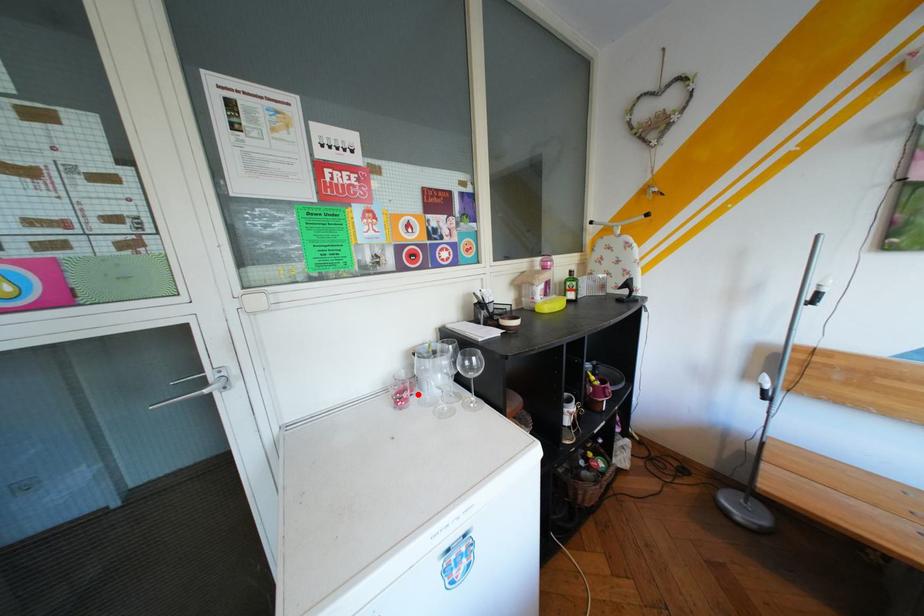
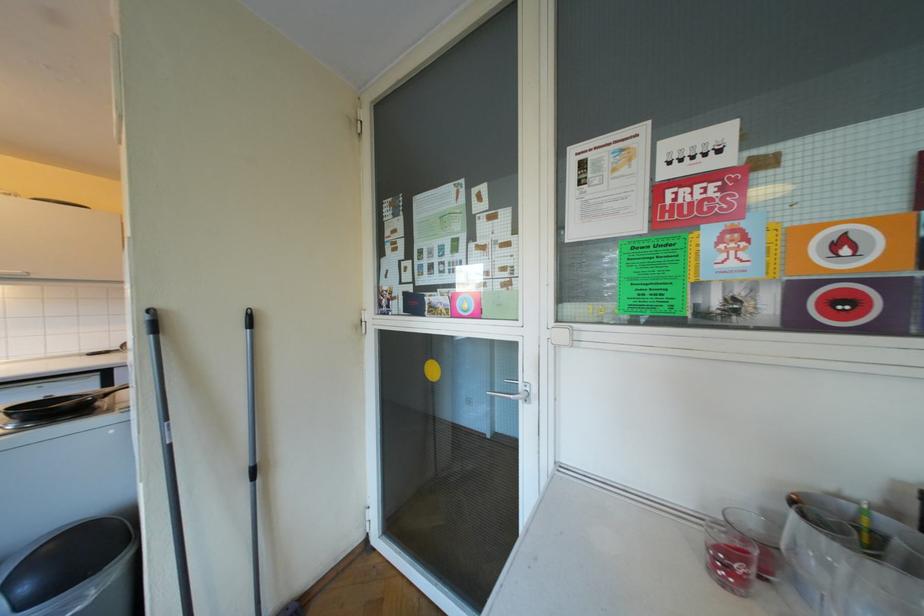
Question: I am providing you with two images of the same scene from different viewpoints. Image1 has a red point marked. In image2, the corresponding 3D location appears at what relative position? Reply with the corresponding letter.

Choices:
 (A) Closer
 (B) Farther

Answer: (A)